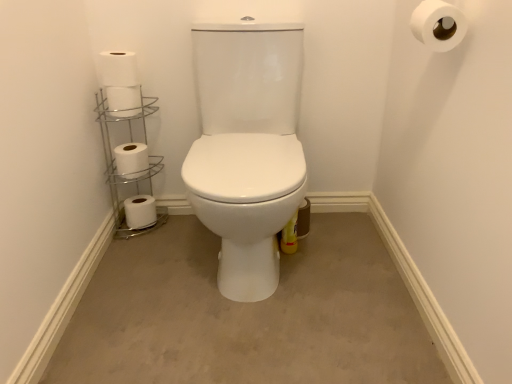
Locate an element on the screen. This screenshot has height=384, width=512. vacant space situated above silver/metallic toilet paper holder at left (from a real-world perspective) is located at coordinates (126, 106).